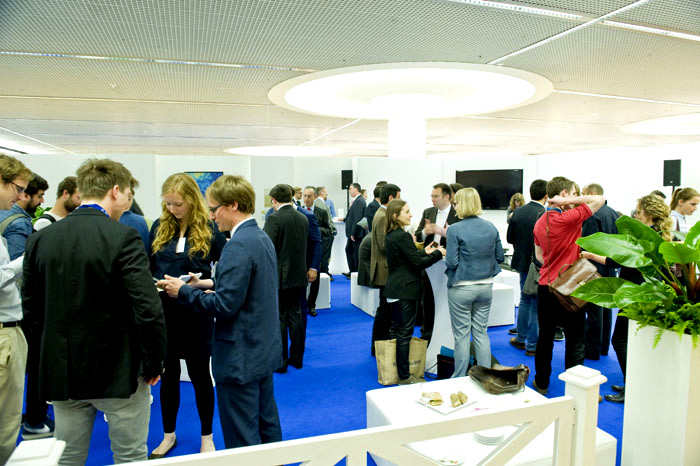
The height and width of the screenshot is (466, 700). I want to click on wall, so click(x=146, y=163), click(x=311, y=170), click(x=617, y=175).